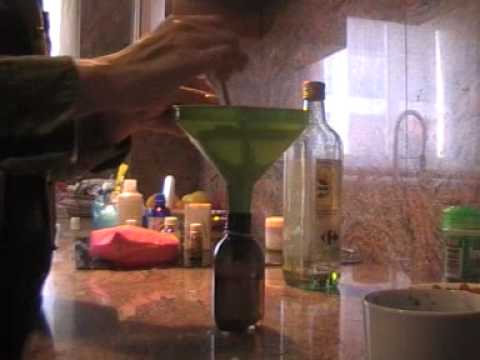
You are a GUI agent. You are given a task and a screenshot of the screen. Output one action in this format:
    pyautogui.click(x=<x>, y=<y>)
    Task: Click on the bottle
    The height and width of the screenshot is (360, 480).
    Given the screenshot: What is the action you would take?
    pyautogui.click(x=229, y=297), pyautogui.click(x=312, y=190)